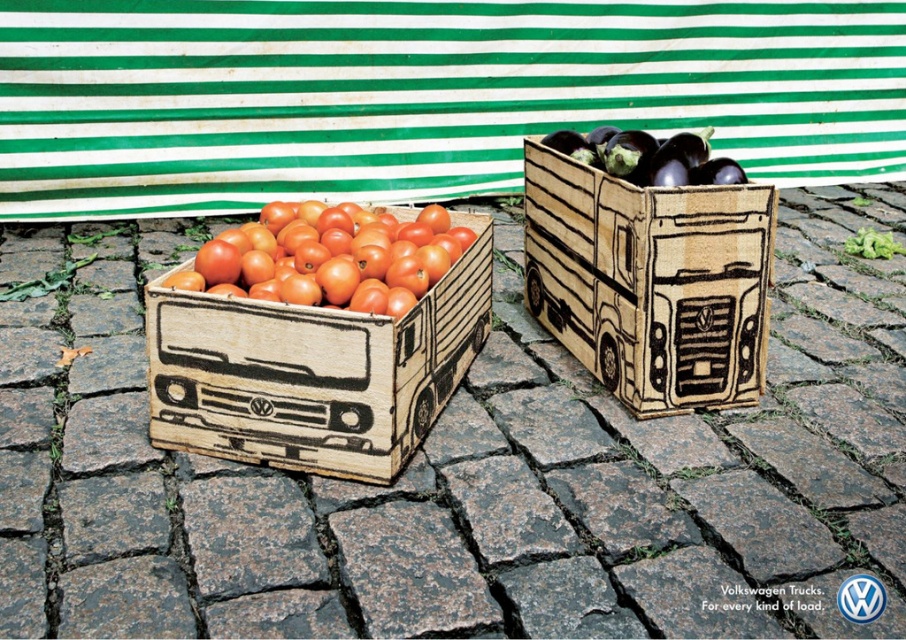
You are a delivery person who needs to place a package between the wooden crate at center and the shiny orange tomatoes at left. The package requires 60 centimeters of space. Is there enough space between them?

The wooden crate at center and shiny orange tomatoes at left are 66.92 centimeters apart from each other, so yes, there is enough space to place the package between them since 66.92 cm is greater than 60 cm.

You are a customer at a farmer market and want to buy the shiny purple eggplant at upper right. You are standing in front of the wooden truck at center. Can you reach the eggplant without moving from your current position?

The wooden truck at center is in front of the shiny purple eggplant at upper right, so you cannot reach the eggplant without moving from your current position because the wooden truck is blocking your access to it.

You are standing at the point marked by point (461, 470). Looking around, you see wooden crate at center. What is the nearest object to you?

The nearest object to you is the wooden crate at center, as you are standing exactly at the point marking its location.